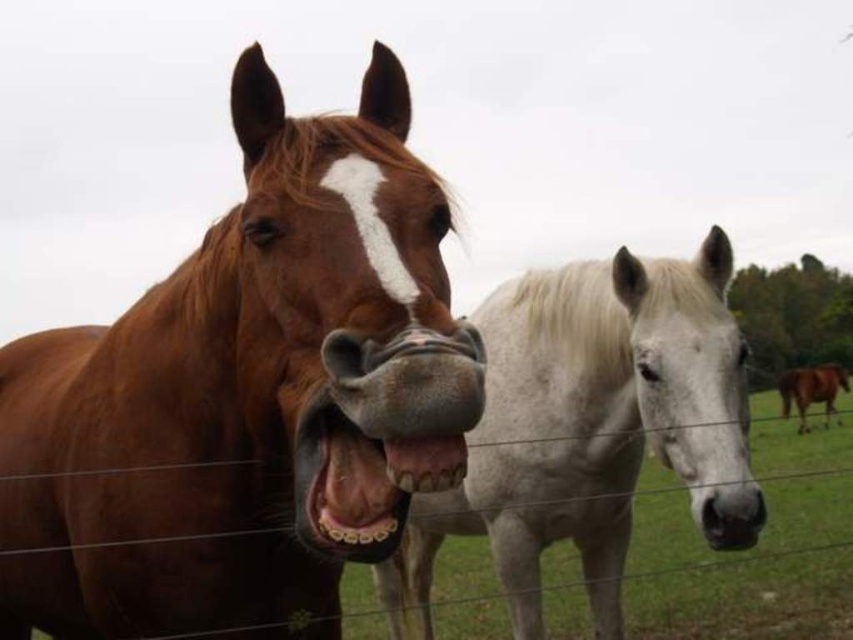
Question: Which of these objects is positioned farthest from the brown glossy horse at right?

Choices:
 (A) teethporcelainmouth at center
 (B) black rubber nose at center
 (C) white glossy horse at center

Answer: (A)

Question: Does brown glossy horse at left appear under black rubber nose at center?

Choices:
 (A) yes
 (B) no

Answer: (B)

Question: Which point appears farthest from the camera in this image?

Choices:
 (A) (447, 531)
 (B) (339, 548)
 (C) (786, 372)

Answer: (C)

Question: Can you confirm if white glossy horse at center is positioned to the right of black rubber nose at center?

Choices:
 (A) yes
 (B) no

Answer: (B)

Question: Can you confirm if brown glossy horse at left is thinner than teeth metallic at center?

Choices:
 (A) no
 (B) yes

Answer: (A)

Question: Which of the following is the closest to the observer?

Choices:
 (A) black rubber nose at center
 (B) brown glossy horse at right
 (C) teethporcelainmouth at center

Answer: (C)